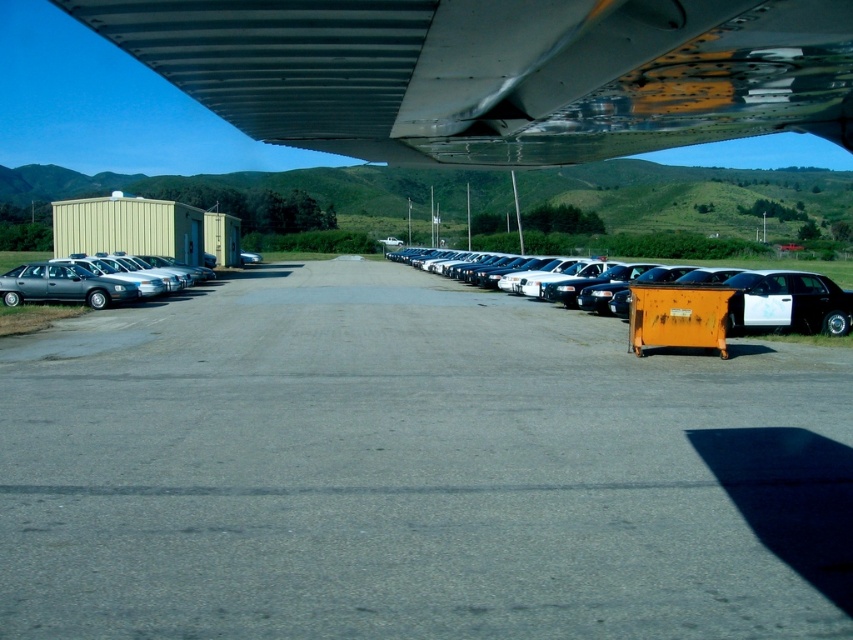
Is point (595, 410) more distant than point (303, 99)?

That is False.

Can you confirm if gray asphalt runway at lower left is bigger than metallic gray wing at upper center?

Indeed, gray asphalt runway at lower left has a larger size compared to metallic gray wing at upper center.

Which is in front, point (164, 456) or point (440, 1)?

Point (440, 1)

Identify the location of gray asphalt runway at lower left. Image resolution: width=853 pixels, height=640 pixels. (415, 470).

Is metallic silver sedan at center right wider than metallic silver sedan at left?

Yes, metallic silver sedan at center right is wider than metallic silver sedan at left.

Measure the distance between metallic silver sedan at center right and metallic silver sedan at left.

metallic silver sedan at center right and metallic silver sedan at left are 18.45 meters apart.

What do you see at coordinates (724, 296) in the screenshot?
I see `metallic silver sedan at center right` at bounding box center [724, 296].

Locate an element on the screen. The height and width of the screenshot is (640, 853). metallic silver sedan at center right is located at coordinates (724, 296).

Is point (703, 458) positioned after point (38, 264)?

No, (703, 458) is closer to viewer.

Is gray asphalt runway at lower left further to the viewer compared to metallic silver sedan at left?

That is False.

Which is behind, point (35, 572) or point (57, 291)?

The point (57, 291) is behind.

Where is `gray asphalt runway at lower left`? This screenshot has height=640, width=853. gray asphalt runway at lower left is located at coordinates (415, 470).